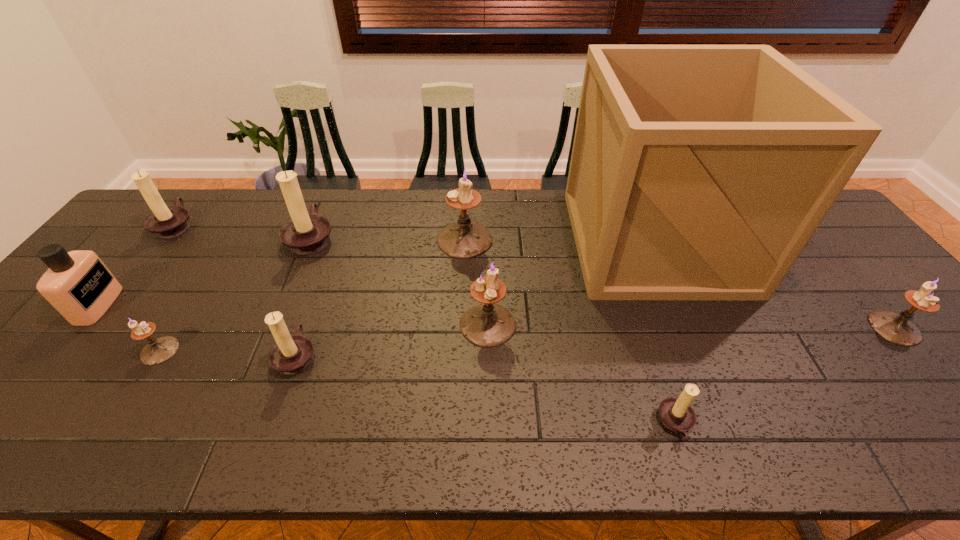
In order to click on vacant space that satisfies the following two spatial constraints: 1. on the wick of the rightmost object; 2. on the right side of the third smallest brown candle holder in this screenshot , I will do `click(94, 328)`.